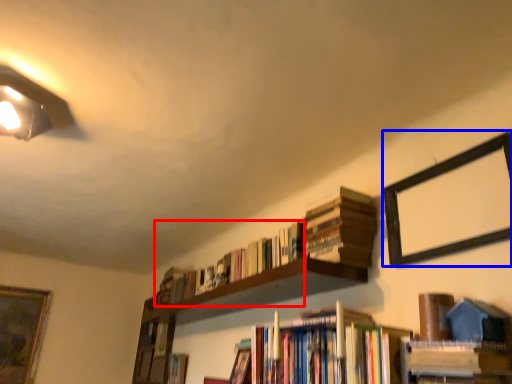
Question: Which of the following is the farthest to the observer, book (highlighted by a red box) or picture frame (highlighted by a blue box)?

Choices:
 (A) book
 (B) picture frame

Answer: (A)